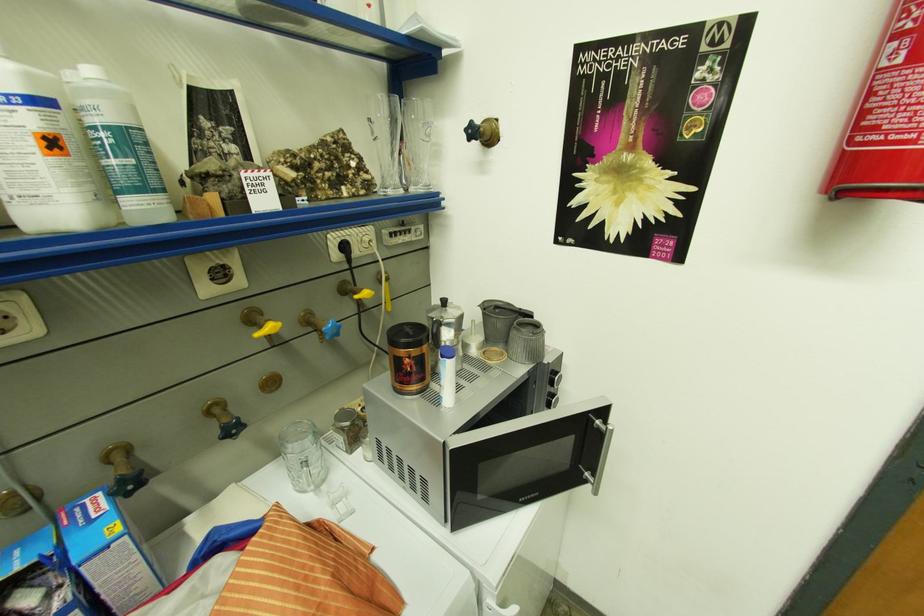
Locate an element on the screen. The height and width of the screenshot is (616, 924). blue valve handle is located at coordinates (320, 325).